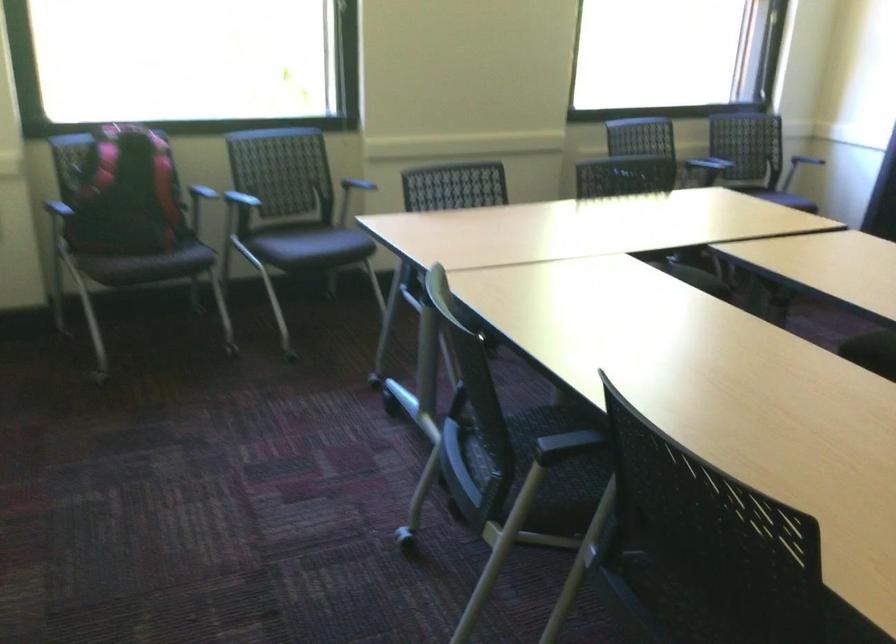
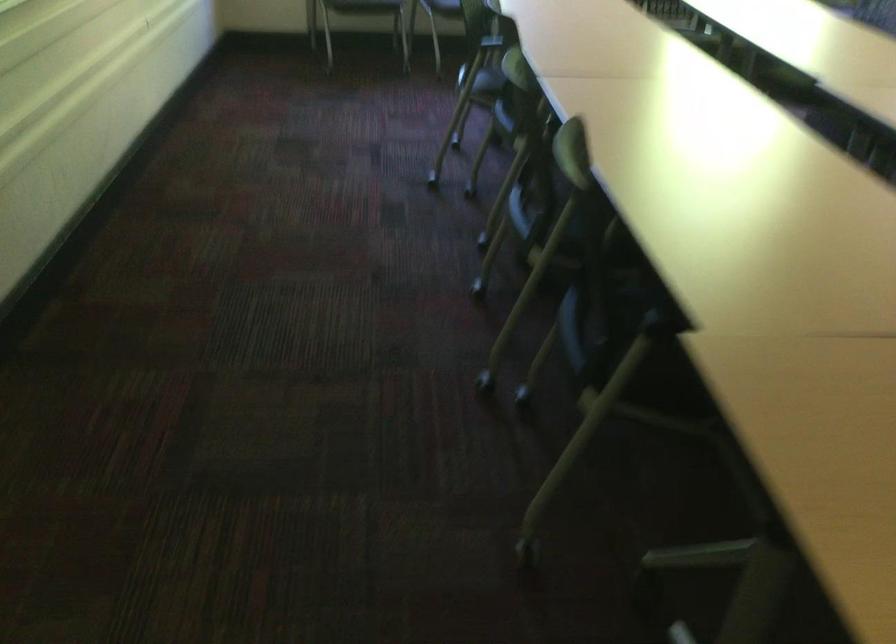
In the second image, find the point that corresponds to the point at 526,533 in the first image.

(478, 93)